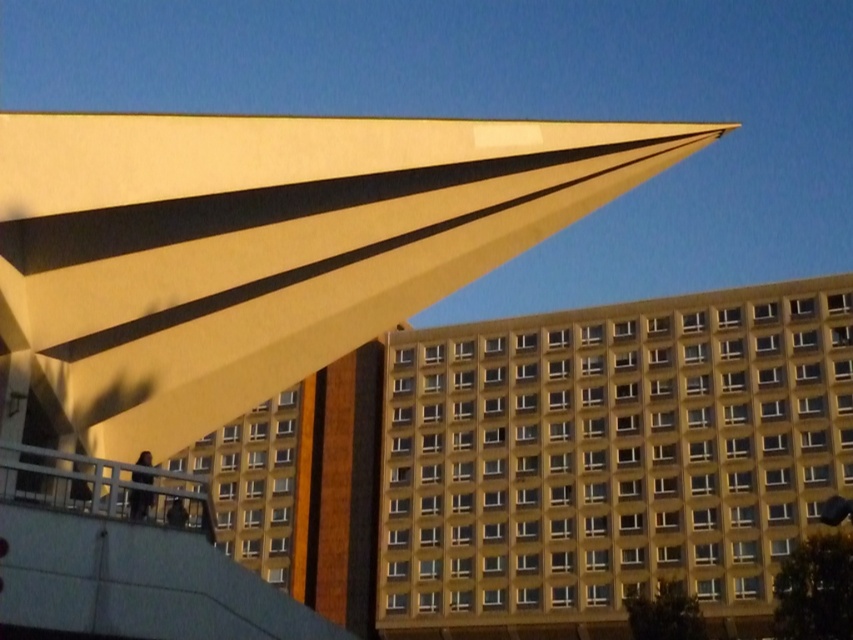
Question: Does brown brick building at center appear under yellowish concrete building at center?

Choices:
 (A) no
 (B) yes

Answer: (A)

Question: Among these points, which one is nearest to the camera?

Choices:
 (A) (171, 456)
 (B) (529, 630)

Answer: (A)

Question: Which of the following is the closest to the observer?

Choices:
 (A) yellowish concrete building at center
 (B) brown brick building at center

Answer: (A)

Question: Which of the following is the farthest from the observer?

Choices:
 (A) brown brick building at center
 (B) yellowish concrete building at center

Answer: (A)

Question: Is brown brick building at center smaller than yellowish concrete building at center?

Choices:
 (A) no
 (B) yes

Answer: (A)

Question: Where is brown brick building at center located in relation to yellowish concrete building at center in the image?

Choices:
 (A) above
 (B) below

Answer: (A)